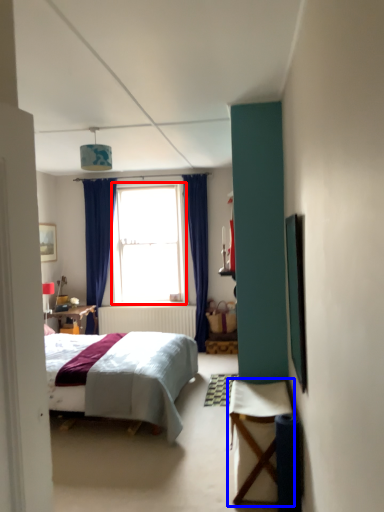
Question: Which of the following is the farthest to the observer, window (highlighted by a red box) or table (highlighted by a blue box)?

Choices:
 (A) window
 (B) table

Answer: (A)